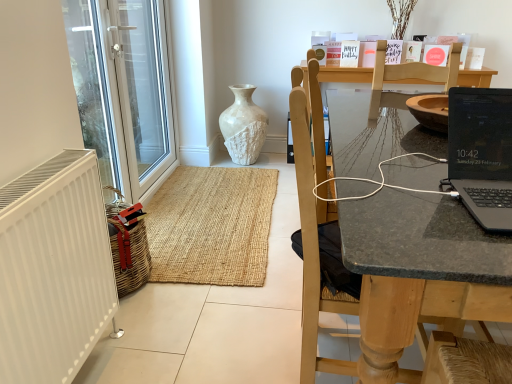
Question: From the image's perspective, is transparent glass door at left above or below white textured vase at center?

Choices:
 (A) below
 (B) above

Answer: (B)

Question: Is point (76, 96) closer or farther from the camera than point (251, 122)?

Choices:
 (A) farther
 (B) closer

Answer: (B)

Question: Based on their relative distances, which object is farther from the white matte radiator at left?

Choices:
 (A) transparent glass door at left
 (B) black glossy laptop at right
 (C) white textured vase at center
 (D) wooden chair at right

Answer: (C)

Question: Estimate the real-world distances between objects in this image. Which object is closer to the white matte radiator at left?

Choices:
 (A) black glossy laptop at right
 (B) wooden chair at right
 (C) white textured vase at center
 (D) transparent glass door at left

Answer: (B)